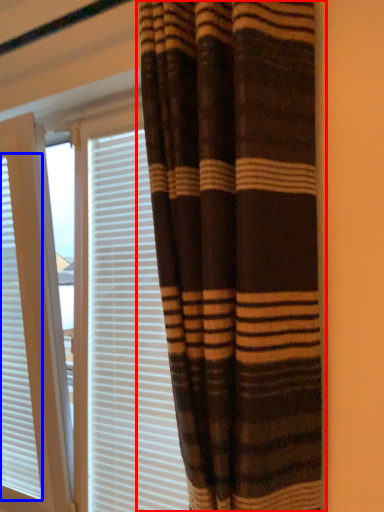
Question: Which point is closer to the camera, curtain (highlighted by a red box) or window blind (highlighted by a blue box)?

Choices:
 (A) curtain
 (B) window blind

Answer: (A)